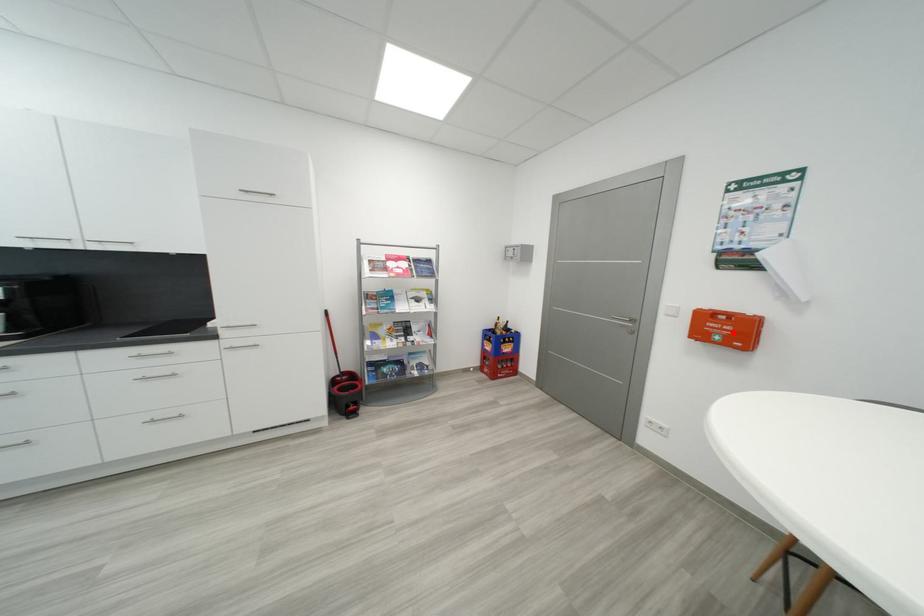
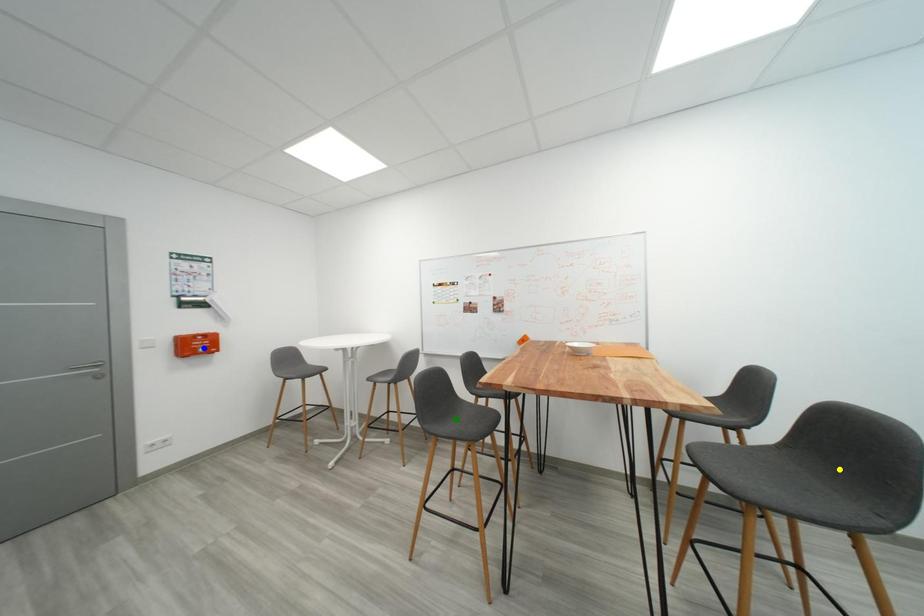
Question: I am providing you with two images of the same scene from different viewpoints. A red point is marked on the first image. You are given multiple points on the second image. In image 2, which mark is for the same physical point as the one in image 1?

Choices:
 (A) green point
 (B) yellow point
 (C) blue point

Answer: (C)